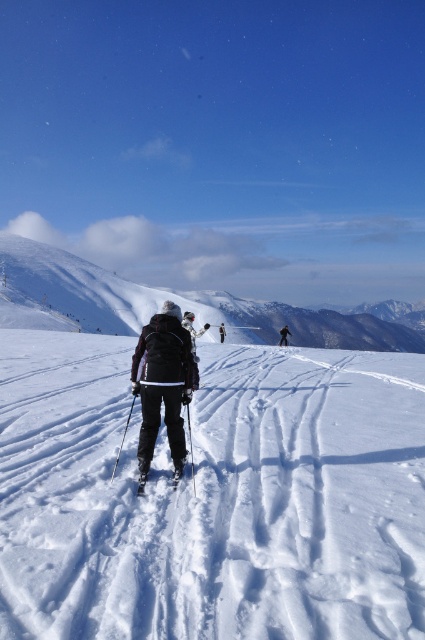
Which is in front, point (416, 349) or point (144, 483)?

Positioned in front is point (144, 483).

Is point (402, 301) farther from camera compared to point (175, 477)?

Yes, point (402, 301) is behind point (175, 477).

Is point (374, 333) closer to viewer compared to point (141, 467)?

No, (374, 333) is further to viewer.

At what (x,y) coordinates should I click in order to perform the action: click on snowy white mountain at upper left. Please return your answer as a coordinate pair (x, y). Looking at the image, I should click on (181, 305).

Measure the distance between point (5,236) and camera.

A distance of 87.13 meters exists between point (5,236) and camera.

Can you confirm if snowy white mountain at upper left is thinner than matte black jacket at center?

No, snowy white mountain at upper left is not thinner than matte black jacket at center.

Who is more forward, (382, 342) or (164, 362)?

Point (164, 362) is more forward.

Where is `snowy white mountain at upper left`? This screenshot has height=640, width=425. snowy white mountain at upper left is located at coordinates (181, 305).

Does snowy white mountain at upper left have a lesser height compared to black ski suit at center?

No, snowy white mountain at upper left is not shorter than black ski suit at center.

Between snowy white mountain at upper left and black ski suit at center, which one has more height?

snowy white mountain at upper left

Which is in front, point (210, 308) or point (282, 337)?

Positioned in front is point (282, 337).

Where is `snowy white mountain at upper left`? snowy white mountain at upper left is located at coordinates (x=181, y=305).